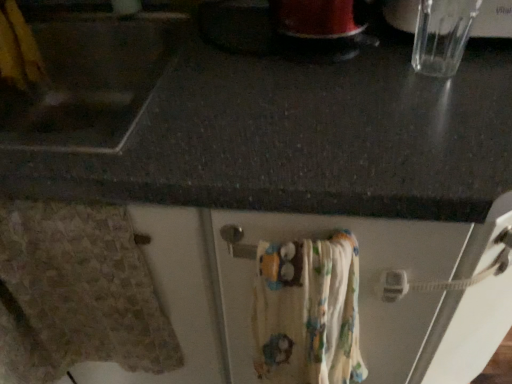
Question: Is beige textured towel at lower left, the 1th bath towel positioned from the left, in front of or behind printed cotton bath towel at lower center, the second bath towel positioned from the left, in the image?

Choices:
 (A) front
 (B) behind

Answer: (B)

Question: From the image's perspective, relative to printed cotton bath towel at lower center, the second bath towel positioned from the left, is beige textured towel at lower left, the second bath towel in the right-to-left sequence, above or below?

Choices:
 (A) below
 (B) above

Answer: (B)

Question: Considering the positions of beige textured towel at lower left, the second bath towel in the right-to-left sequence, and printed cotton bath towel at lower center, placed as the 1th bath towel when sorted from right to left, in the image, is beige textured towel at lower left, the second bath towel in the right-to-left sequence, taller or shorter than printed cotton bath towel at lower center, placed as the 1th bath towel when sorted from right to left,?

Choices:
 (A) tall
 (B) short

Answer: (A)

Question: Choose the correct answer: Is printed cotton bath towel at lower center, placed as the 1th bath towel when sorted from right to left, inside beige textured towel at lower left, the second bath towel in the right-to-left sequence, or outside it?

Choices:
 (A) outside
 (B) inside

Answer: (A)

Question: Looking at the image, does printed cotton bath towel at lower center, the second bath towel positioned from the left, seem bigger or smaller compared to beige textured towel at lower left, the 1th bath towel positioned from the left?

Choices:
 (A) big
 (B) small

Answer: (A)

Question: From the image's perspective, relative to beige textured towel at lower left, the 1th bath towel positioned from the left, is printed cotton bath towel at lower center, placed as the 1th bath towel when sorted from right to left, above or below?

Choices:
 (A) above
 (B) below

Answer: (B)

Question: In terms of width, does printed cotton bath towel at lower center, placed as the 1th bath towel when sorted from right to left, look wider or thinner when compared to beige textured towel at lower left, the second bath towel in the right-to-left sequence?

Choices:
 (A) wide
 (B) thin

Answer: (A)